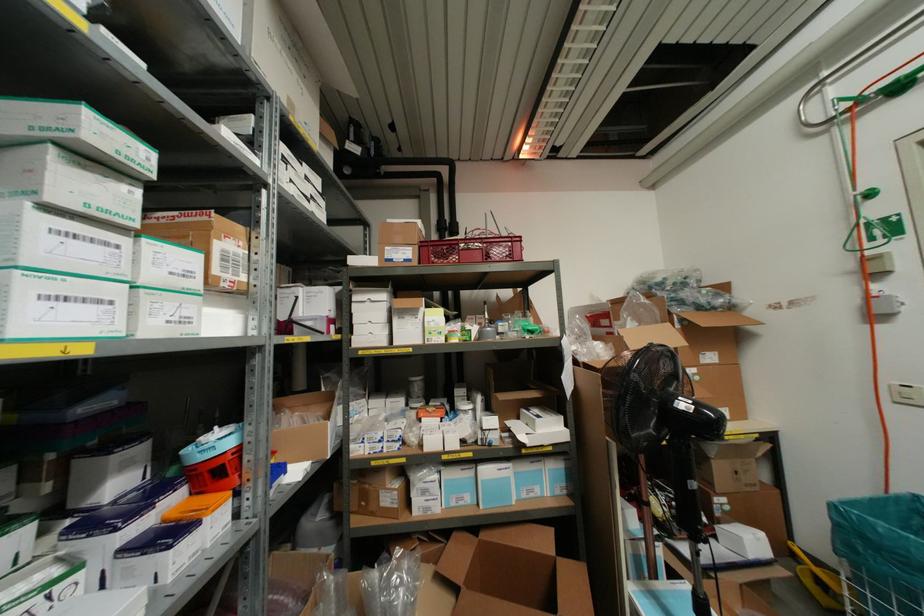
The image size is (924, 616). Describe the element at coordinates (906, 394) in the screenshot. I see `the white light switch` at that location.